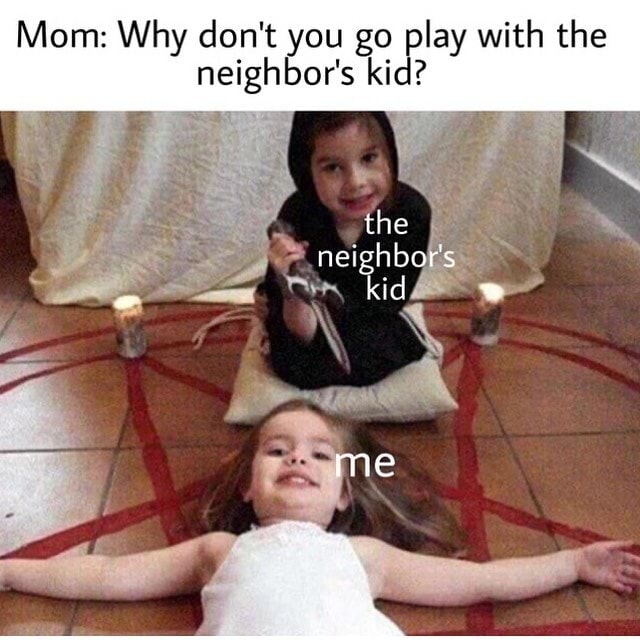
Identify the location of tile. (550, 432).